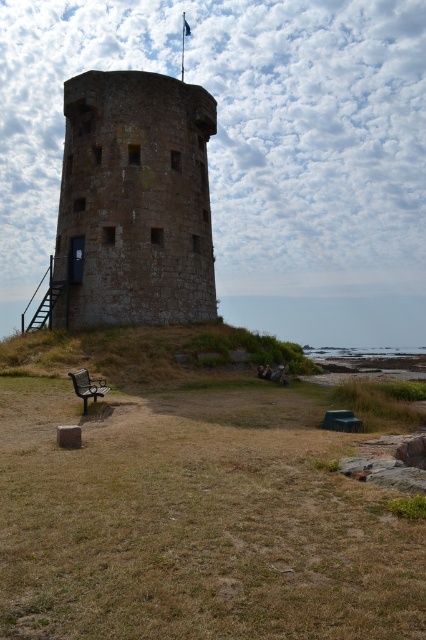
Is brown stone tower at center in front of wooden bench at lower left?

No, brown stone tower at center is behind wooden bench at lower left.

The image size is (426, 640). What are the coordinates of `brown stone tower at center` in the screenshot? It's located at (135, 200).